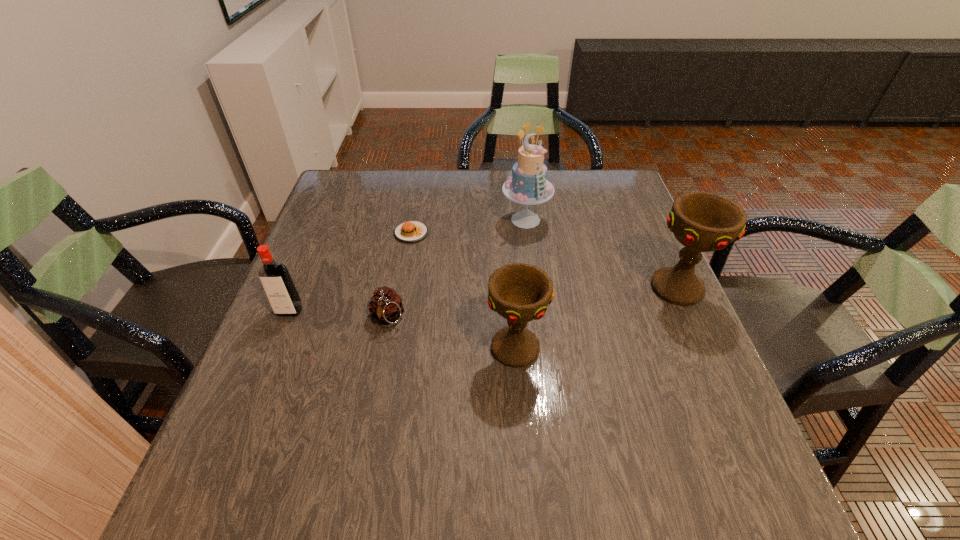
Locate an element on the screen. This screenshot has height=540, width=960. vacant region located 0.100m on the right of the food is located at coordinates tap(466, 233).

Where is `free space located with a ladder on the side of the tallest object`? This screenshot has width=960, height=540. free space located with a ladder on the side of the tallest object is located at coordinates (534, 285).

Image resolution: width=960 pixels, height=540 pixels. Identify the location of vacant space located 0.070m with a leaf charm attached to the pinecone. (378, 361).

Where is `free location located 0.050m on the front and back of the vodka`? Image resolution: width=960 pixels, height=540 pixels. free location located 0.050m on the front and back of the vodka is located at coordinates (279, 336).

This screenshot has height=540, width=960. Identify the location of object present at the far edge. (528, 185).

In order to click on object at the left edge in this screenshot , I will do `click(280, 290)`.

The image size is (960, 540). I want to click on object positioned at the right edge, so click(x=702, y=222).

In the image, there is a desktop. At what (x,y) coordinates should I click in order to perform the action: click on vacant region at the far edge. Please return your answer as a coordinate pair (x, y). This screenshot has height=540, width=960. Looking at the image, I should click on (404, 180).

Where is `vacant space at the near edge of the desktop`? The image size is (960, 540). vacant space at the near edge of the desktop is located at coordinates click(482, 437).

Find the location of `free space at the left edge of the desktop`. free space at the left edge of the desktop is located at coordinates (348, 261).